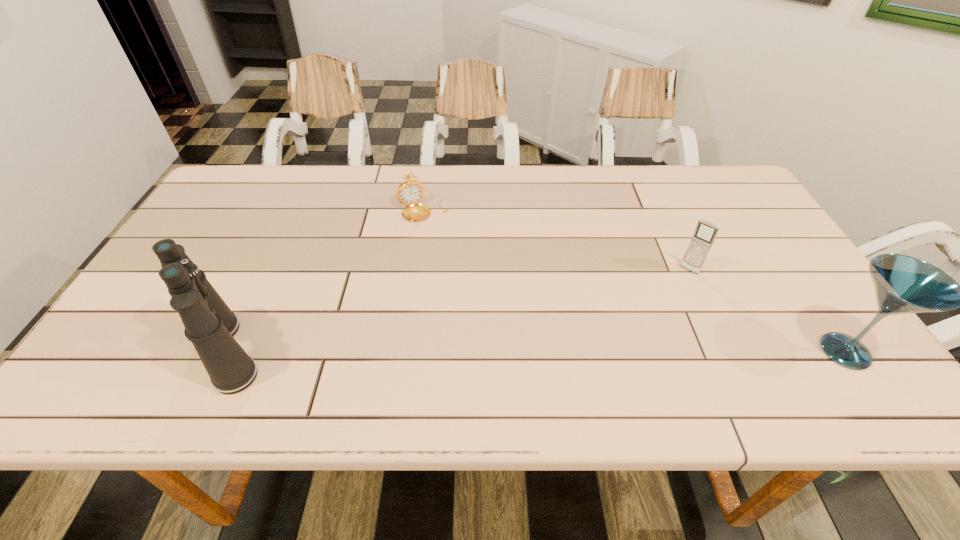
The image size is (960, 540). In order to click on free space that is in between the second farthest object and the pocket watch in this screenshot , I will do `click(556, 239)`.

What are the coordinates of `free space between the martini and the binoculars` in the screenshot? It's located at (537, 352).

I want to click on free space between the third nearest object and the shortest object, so click(556, 239).

You are a GUI agent. You are given a task and a screenshot of the screen. Output one action in this format:
    pyautogui.click(x=<x>, y=<y>)
    Task: Click on the free space between the third object from right to left and the leftmost object
    The height and width of the screenshot is (540, 960).
    Given the screenshot: What is the action you would take?
    pyautogui.click(x=325, y=280)

Select which object appears as the closest to the third shortest object. Please provide its 2D coordinates. Your answer should be formatted as a tuple, i.e. [(x, y)], where the tuple contains the x and y coordinates of a point satisfying the conditions above.

[(706, 231)]

Image resolution: width=960 pixels, height=540 pixels. Identify the location of object identified as the closest to the second tallest object. (706, 231).

Locate an element on the screen. The image size is (960, 540). free location that satisfies the following two spatial constraints: 1. on the back side of the leftmost object; 2. on the right side of the second object from right to left is located at coordinates (267, 271).

Find the location of a particular element. The height and width of the screenshot is (540, 960). free space that satisfies the following two spatial constraints: 1. on the back side of the second tallest object; 2. on the right side of the tallest object is located at coordinates (228, 352).